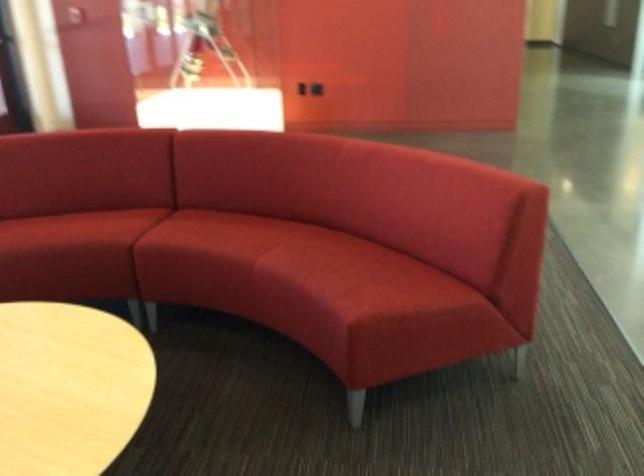
Where is `red sofa sitting surface`? red sofa sitting surface is located at coordinates (328, 258).